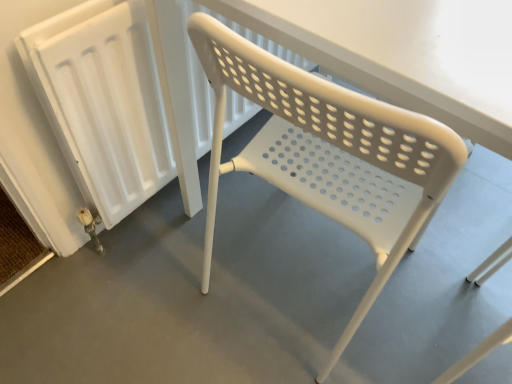
Question: Considering the relative sizes of white plastic chair at center and white plastic chair at center in the image provided, is white plastic chair at center taller than white plastic chair at center?

Choices:
 (A) yes
 (B) no

Answer: (B)

Question: Considering the relative sizes of white plastic chair at center and white plastic chair at center in the image provided, is white plastic chair at center wider than white plastic chair at center?

Choices:
 (A) yes
 (B) no

Answer: (A)

Question: From the image's perspective, is white plastic chair at center beneath white plastic chair at center?

Choices:
 (A) no
 (B) yes

Answer: (B)

Question: Is white plastic chair at center with white plastic chair at center?

Choices:
 (A) no
 (B) yes

Answer: (A)

Question: Considering the relative positions of white plastic chair at center and white plastic chair at center in the image provided, is white plastic chair at center in front of white plastic chair at center?

Choices:
 (A) no
 (B) yes

Answer: (A)

Question: From a real-world perspective, is white plastic radiator at left positioned above or below white plastic chair at center?

Choices:
 (A) below
 (B) above

Answer: (A)

Question: Relative to white plastic chair at center, is white plastic radiator at left in front or behind?

Choices:
 (A) front
 (B) behind

Answer: (B)

Question: Looking at the image, does white plastic radiator at left seem bigger or smaller compared to white plastic chair at center?

Choices:
 (A) big
 (B) small

Answer: (B)

Question: In terms of height, does white plastic radiator at left look taller or shorter compared to white plastic chair at center?

Choices:
 (A) short
 (B) tall

Answer: (A)

Question: Based on their sizes in the image, would you say white plastic chair at center is bigger or smaller than white plastic radiator at left?

Choices:
 (A) small
 (B) big

Answer: (B)

Question: Is white plastic chair at center spatially inside white plastic radiator at left, or outside of it?

Choices:
 (A) inside
 (B) outside

Answer: (B)

Question: Considering the positions of point (380, 150) and point (101, 142), is point (380, 150) closer or farther from the camera than point (101, 142)?

Choices:
 (A) farther
 (B) closer

Answer: (B)

Question: Considering the positions of white plastic chair at center and white plastic radiator at left in the image, is white plastic chair at center wider or thinner than white plastic radiator at left?

Choices:
 (A) thin
 (B) wide

Answer: (B)

Question: Based on their positions, is white plastic chair at center located to the left or right of white plastic chair at center?

Choices:
 (A) left
 (B) right

Answer: (A)

Question: Would you say white plastic chair at center is inside or outside white plastic chair at center?

Choices:
 (A) inside
 (B) outside

Answer: (B)